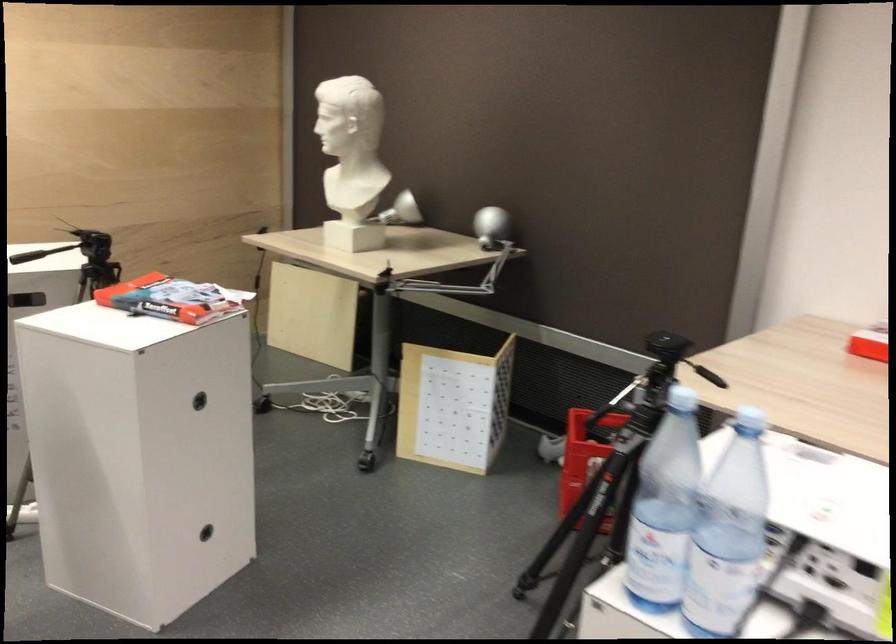
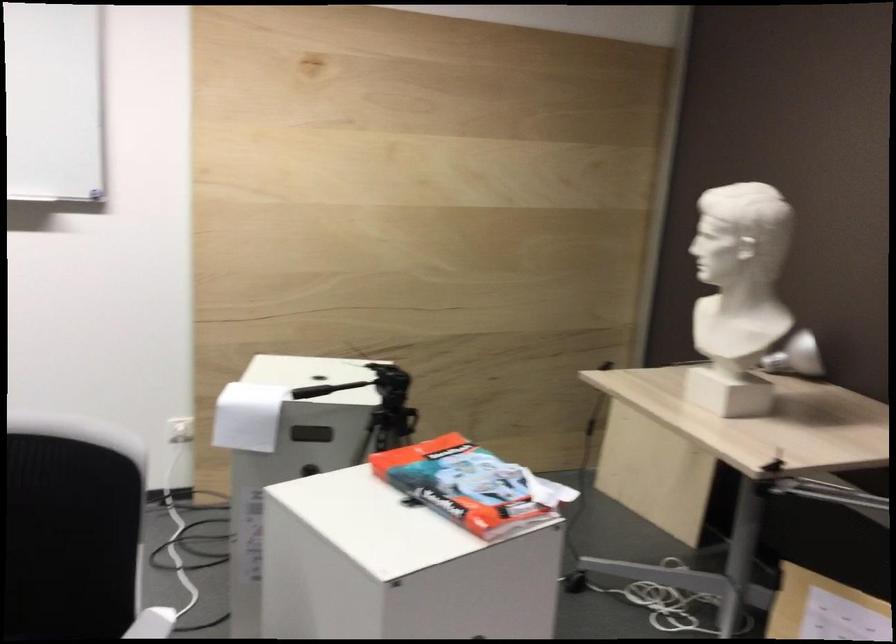
Find the pixel in the second image that matches (394,212) in the first image.

(795, 357)